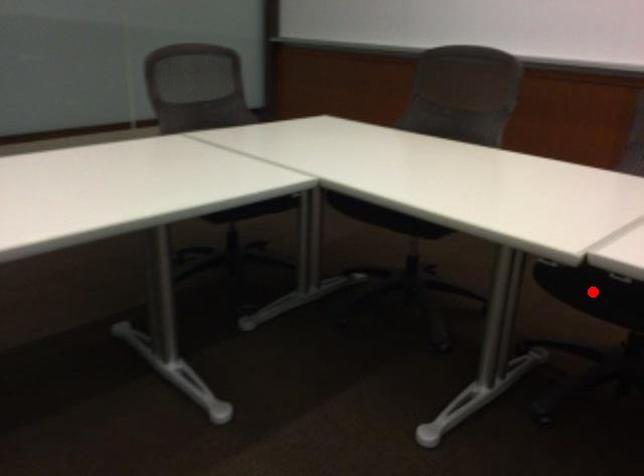
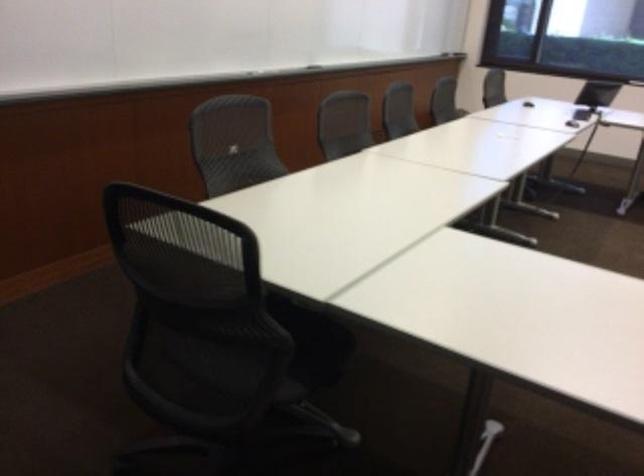
Question: I am providing you with two images of the same scene from different viewpoints. A red point is marked on the first image. Is the red point's position out of view in image 2?

Choices:
 (A) Yes
 (B) No

Answer: (A)